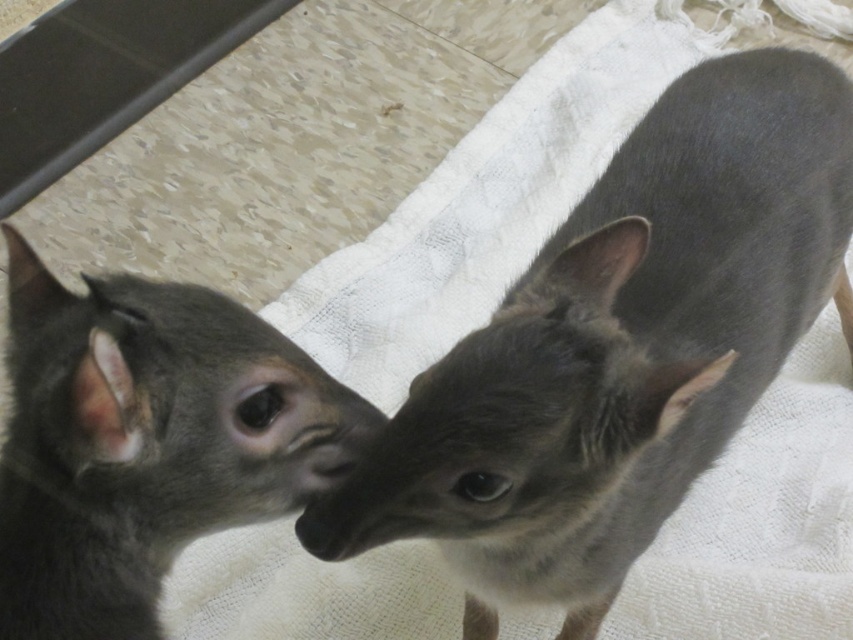
Is smooth gray chihuahua at center bigger than gray matte fur at center?

Indeed, smooth gray chihuahua at center has a larger size compared to gray matte fur at center.

Does point (579, 324) come closer to viewer compared to point (94, 369)?

No.

Is point (520, 404) positioned behind point (207, 449)?

Yes, it is.

Find the location of a particular element. smooth gray chihuahua at center is located at coordinates (619, 348).